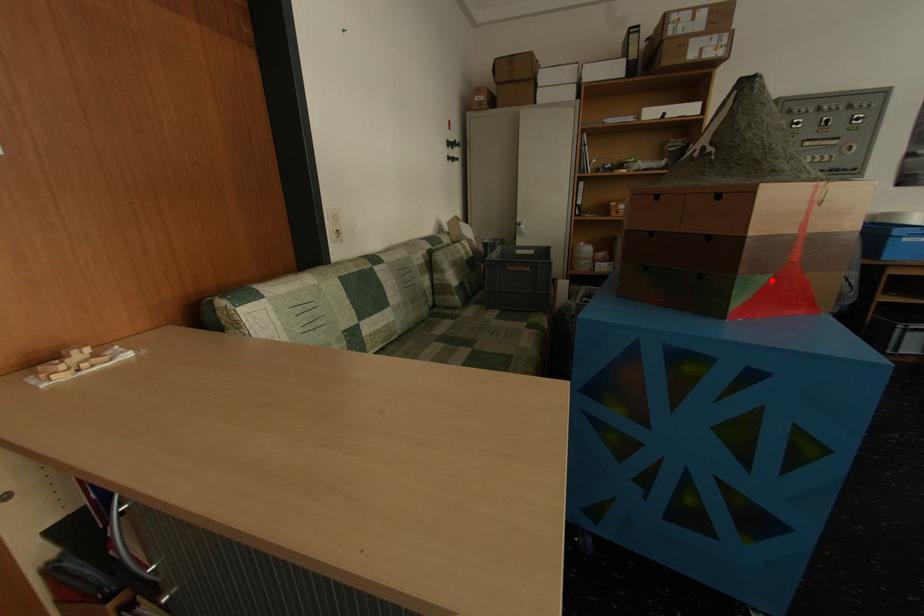
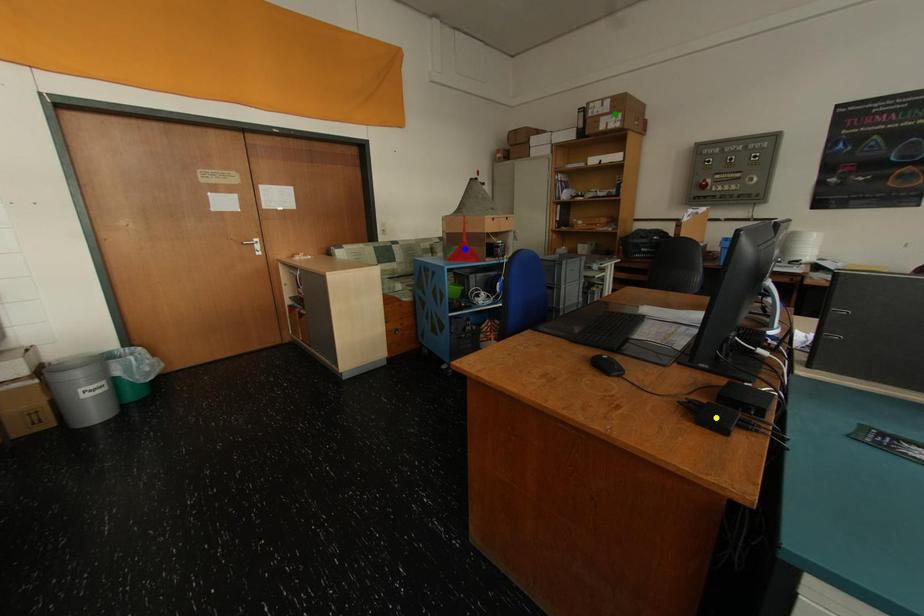
Question: I am providing you with two images of the same scene from different viewpoints. A red point is marked on the first image. You are given multiple points on the second image. Which mark in image 2 goes with the point in image 1?

Choices:
 (A) green point
 (B) blue point
 (C) yellow point

Answer: (B)